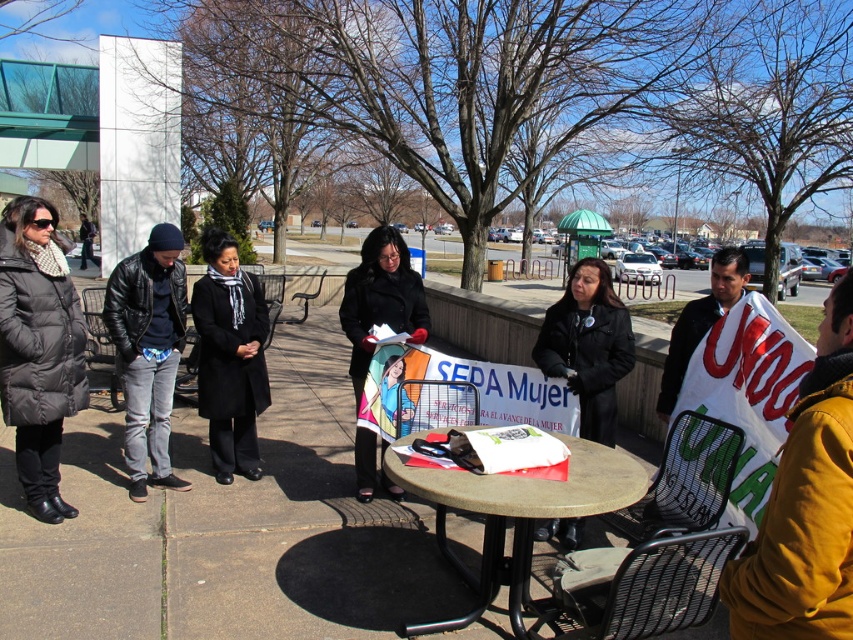
You are a photographer trying to capture a photo of the group at the round table. You want to ensure that both the black puffer coat at left and the black wool coat at center are clearly visible in the frame. Given their height differences, which coat might you need to adjust your camera angle to include fully in the shot?

The black puffer coat at left is much taller than the black wool coat at center, so you might need to angle your camera upward to ensure the entire height of the black puffer coat at left is captured in the photo.